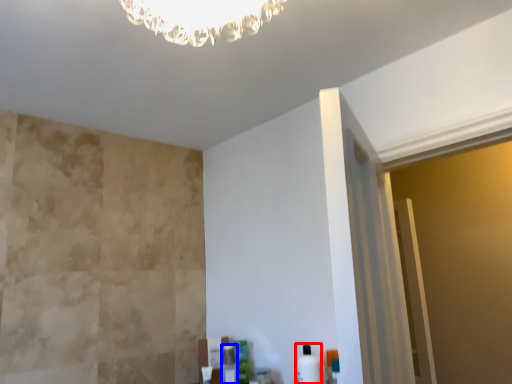
Question: Which of the following is the farthest to the observer, toiletry (highlighted by a red box) or toiletry (highlighted by a blue box)?

Choices:
 (A) toiletry
 (B) toiletry

Answer: (B)